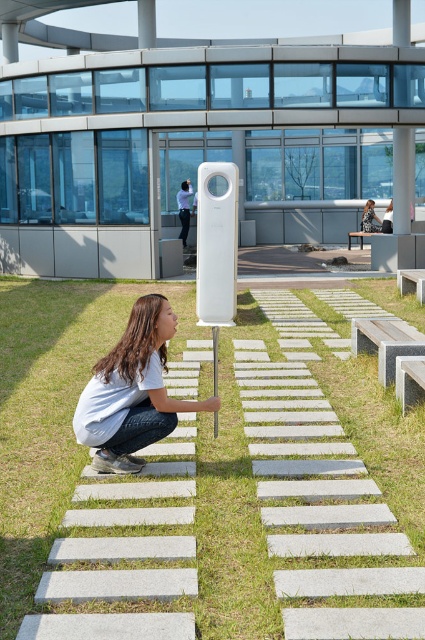
Who is positioned more to the left, green grass at center or white matte girl at center?

white matte girl at center is more to the left.

Can you confirm if green grass at center is positioned below white matte girl at center?

Correct, green grass at center is located below white matte girl at center.

Which is behind, point (377, 579) or point (206, 406)?

Positioned behind is point (206, 406).

Find the location of a particular element. This screenshot has width=425, height=640. green grass at center is located at coordinates (198, 499).

Is white matte girl at center smaller than white glossy pillar at upper center?

Yes.

Does white matte girl at center have a lesser height compared to white glossy pillar at upper center?

Yes.

Is point (164, 326) less distant than point (399, 230)?

Yes, it is.

This screenshot has height=640, width=425. I want to click on white matte girl at center, so click(x=132, y=392).

Who is positioned more to the right, white glossy pillar at upper center or white wooden bench at center?

white glossy pillar at upper center

Between white glossy pillar at upper center and white wooden bench at center, which one is positioned lower?

Positioned lower is white wooden bench at center.

This screenshot has height=640, width=425. I want to click on white glossy pillar at upper center, so click(x=402, y=177).